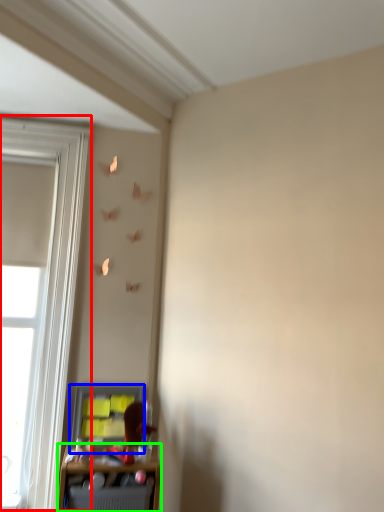
Question: Which is nearer to the window (highlighted by a red box)? cabinet (highlighted by a blue box) or shelf (highlighted by a green box).

Choices:
 (A) cabinet
 (B) shelf

Answer: (A)